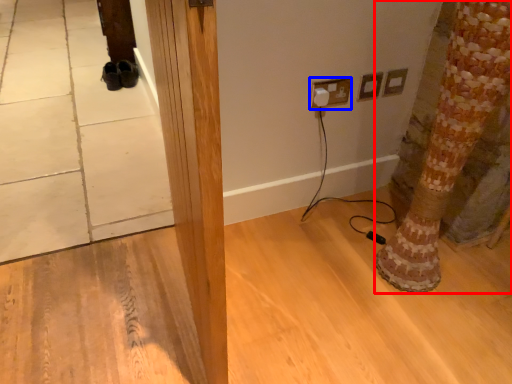
Question: Which object is further to the camera taking this photo, tree trunk (highlighted by a red box) or electric outlet (highlighted by a blue box)?

Choices:
 (A) tree trunk
 (B) electric outlet

Answer: (B)